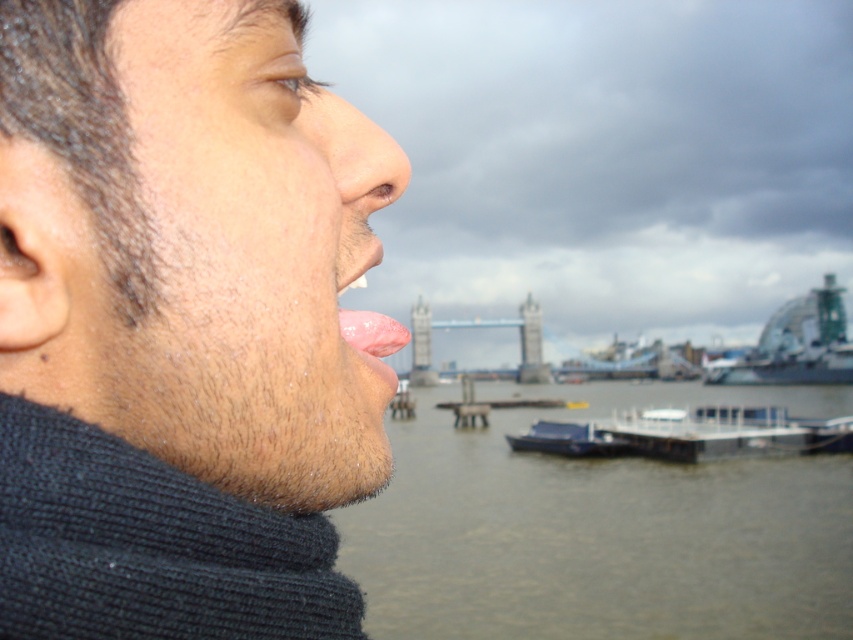
Which of these two, brown water at lower center or green glass dome at center, stands taller?

With more height is brown water at lower center.

Which is more to the left, brown water at lower center or green glass dome at center?

brown water at lower center

The height and width of the screenshot is (640, 853). In order to click on brown water at lower center in this screenshot , I will do (x=602, y=529).

Which is more to the right, matte skin nose at center or smooth blue boat at center?

smooth blue boat at center

Between point (332, 108) and point (518, 442), which one is positioned behind?

Point (518, 442)

What do you see at coordinates (354, 152) in the screenshot?
I see `matte skin nose at center` at bounding box center [354, 152].

The width and height of the screenshot is (853, 640). I want to click on matte skin nose at center, so click(354, 152).

Between smooth skin face at left and brown water at lower center, which one has more height?

brown water at lower center is taller.

Find the location of a particular element. The image size is (853, 640). smooth skin face at left is located at coordinates (244, 264).

Is point (84, 412) positioned after point (578, 563)?

No, (84, 412) is in front of (578, 563).

I want to click on smooth skin face at left, so click(244, 264).